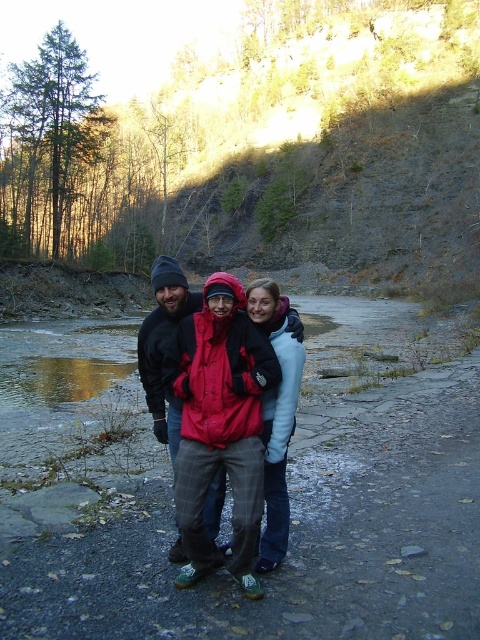
Question: Is light blue fleece jacket at center to the right of plaid woolen pants at center from the viewer's perspective?

Choices:
 (A) no
 (B) yes

Answer: (B)

Question: Is matte red jacket at center thinner than plaid woolen pants at center?

Choices:
 (A) yes
 (B) no

Answer: (A)

Question: Which of the following is the farthest from the observer?

Choices:
 (A) (276, 529)
 (B) (156, 269)

Answer: (B)

Question: Does matte red jacket at center come in front of light blue fleece jacket at center?

Choices:
 (A) yes
 (B) no

Answer: (A)

Question: Which point is farther to the camera?

Choices:
 (A) (156, 419)
 (B) (275, 349)
 (C) (273, 364)

Answer: (A)

Question: Which point is closer to the camera?

Choices:
 (A) plaid woolen pants at center
 (B) matte red jacket at center
 (C) light blue fleece jacket at center

Answer: (B)